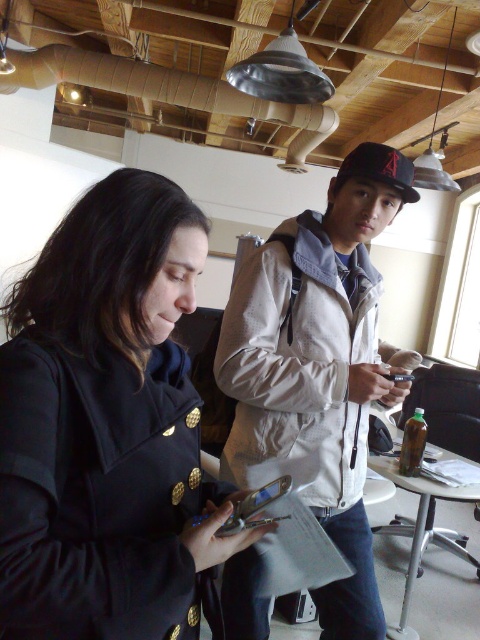
Question: Estimate the real-world distances between objects in this image. Which object is closer to the black matte coat at center?

Choices:
 (A) light beige jacket at center
 (B) silver metallic phone at center

Answer: (B)

Question: Where is black matte coat at center located in relation to silver metallic phone at center in the image?

Choices:
 (A) left
 (B) right

Answer: (A)

Question: Estimate the real-world distances between objects in this image. Which object is farther from the light beige jacket at center?

Choices:
 (A) black matte coat at center
 (B) silver metallic phone at center

Answer: (B)

Question: Among these points, which one is nearest to the camera?

Choices:
 (A) (275, 488)
 (B) (312, 333)
 (C) (9, 518)

Answer: (C)

Question: Does black matte coat at center have a smaller size compared to light beige jacket at center?

Choices:
 (A) yes
 (B) no

Answer: (A)

Question: Can you confirm if black matte coat at center is positioned above silver metallic phone at center?

Choices:
 (A) yes
 (B) no

Answer: (A)